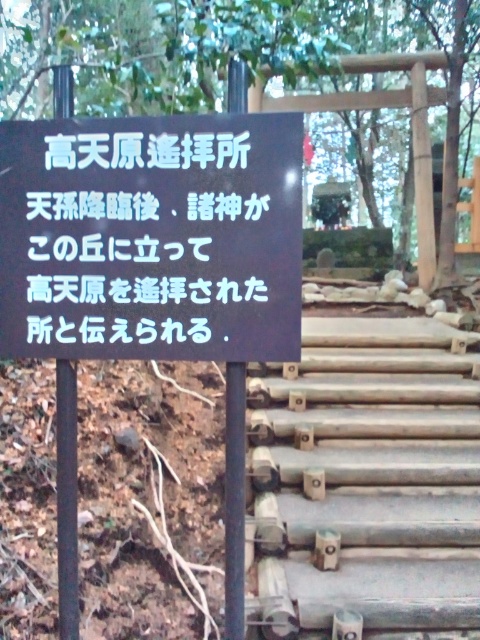
Can you confirm if black matte sign at center is smaller than smooth wooden stairs at center?

Correct, black matte sign at center occupies less space than smooth wooden stairs at center.

Consider the image. Who is more distant from viewer, (294,304) or (322,477)?

The point (322,477) is more distant.

This screenshot has width=480, height=640. Describe the element at coordinates (152, 237) in the screenshot. I see `black matte sign at center` at that location.

The image size is (480, 640). I want to click on black matte sign at center, so click(152, 237).